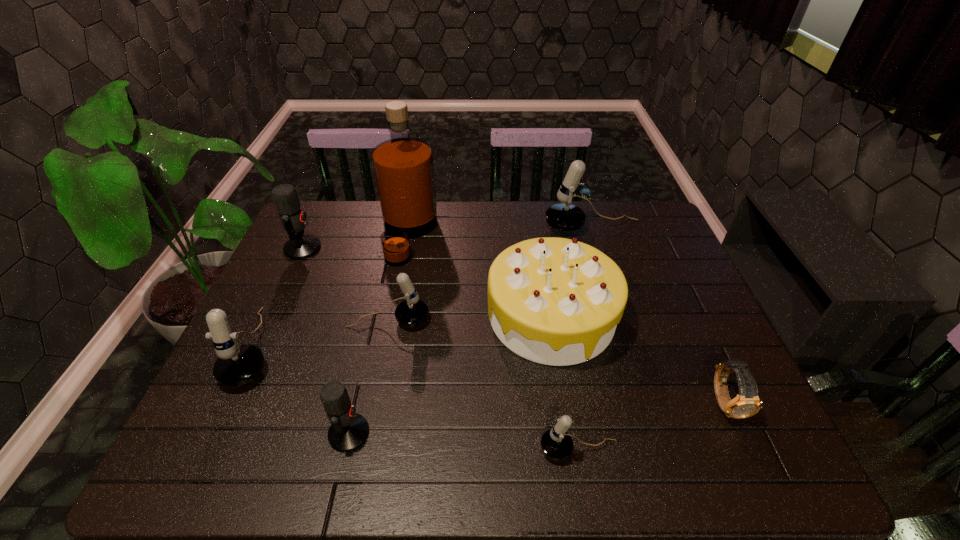
Where is `the tallest object`? Image resolution: width=960 pixels, height=540 pixels. the tallest object is located at coordinates (403, 166).

Locate an element on the screen. This screenshot has width=960, height=540. the biggest white microphone is located at coordinates (565, 217).

Identify the location of the left red microphone. (300, 246).

Locate an element on the screen. Image resolution: width=960 pixels, height=540 pixels. the farther red microphone is located at coordinates (300, 246).

I want to click on birthday cake, so click(x=555, y=301).

At what (x,y) coordinates should I click in order to perform the action: click on the leftmost white microphone. Please return your answer as a coordinate pair (x, y). The width and height of the screenshot is (960, 540). Looking at the image, I should click on (237, 364).

The image size is (960, 540). Find the location of `the second smallest white microphone`. the second smallest white microphone is located at coordinates (412, 312).

What are the coordinates of `the right red microphone` in the screenshot? It's located at (349, 430).

This screenshot has height=540, width=960. I want to click on the smaller red microphone, so click(349, 430).

The height and width of the screenshot is (540, 960). I want to click on the smallest white microphone, so tap(556, 443).